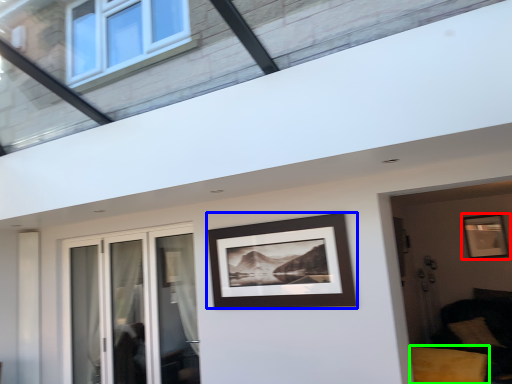
Question: Considering the real-world distances, which object is closest to picture frame (highlighted by a red box)? picture frame (highlighted by a blue box) or furniture (highlighted by a green box).

Choices:
 (A) picture frame
 (B) furniture

Answer: (B)